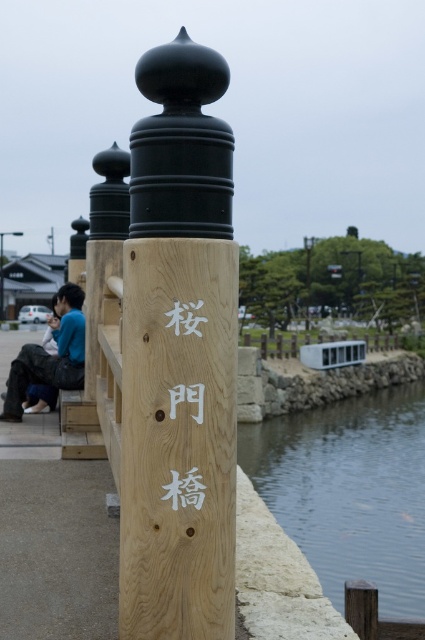
Does natural wood signpost at center have a larger size compared to white wood sign at center?

Yes, natural wood signpost at center is bigger than white wood sign at center.

Can you confirm if natural wood signpost at center is smaller than white wood sign at center?

No, natural wood signpost at center is not smaller than white wood sign at center.

Between point (227, 406) and point (193, 481), which one is positioned in front?

Positioned in front is point (193, 481).

You are a GUI agent. You are given a task and a screenshot of the screen. Output one action in this format:
    pyautogui.click(x=<x>, y=<y>)
    Task: Click on the natural wood signpost at center
    This screenshot has height=640, width=425.
    Given the screenshot: What is the action you would take?
    pyautogui.click(x=178, y=356)

Who is lower down, clear water at lower right or white wood sign at center?

Positioned lower is clear water at lower right.

Can you confirm if clear water at lower right is positioned to the right of white wood sign at center?

Yes, clear water at lower right is to the right of white wood sign at center.

Measure the distance between clear water at lower right and camera.

A distance of 13.96 feet exists between clear water at lower right and camera.

What are the coordinates of `clear water at lower right` in the screenshot? It's located at (350, 490).

Is clear water at lower right closer to the viewer compared to blue cotton shirt at left?

Yes, clear water at lower right is closer to the viewer.

Is point (339, 589) closer to viewer compared to point (68, 372)?

No.

Locate an element on the screen. The height and width of the screenshot is (640, 425). clear water at lower right is located at coordinates (350, 490).